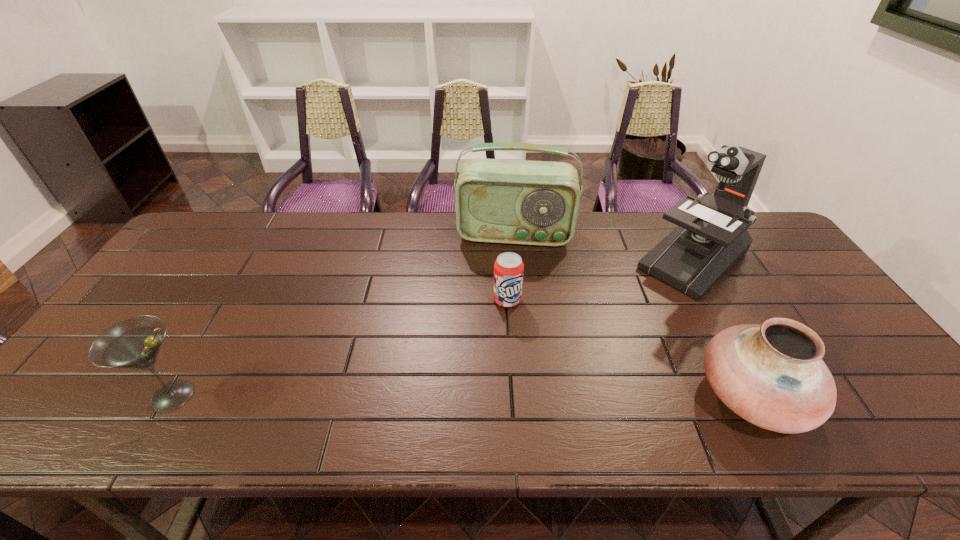
Identify the location of free point located through the eyepieces of the microscope. This screenshot has width=960, height=540. (642, 305).

Where is `vacant space situated 0.340m through the eyepieces of the microscope`? This screenshot has height=540, width=960. vacant space situated 0.340m through the eyepieces of the microscope is located at coordinates (589, 352).

You are a GUI agent. You are given a task and a screenshot of the screen. Output one action in this format:
    pyautogui.click(x=<x>, y=<y>)
    Task: Click on the vacant point located 0.220m through the eyepieces of the microscope
    The width and height of the screenshot is (960, 540).
    Given the screenshot: What is the action you would take?
    pyautogui.click(x=617, y=327)

In order to click on vacant region located 0.330m on the front panel of the radio receiver in this screenshot , I will do `click(504, 328)`.

This screenshot has height=540, width=960. I want to click on free space located on the front panel of the radio receiver, so click(x=507, y=294).

This screenshot has height=540, width=960. What are the coordinates of `free region located on the front panel of the radio receiver` in the screenshot? It's located at (508, 284).

The width and height of the screenshot is (960, 540). Identify the location of microscope present at the far edge. (711, 237).

The width and height of the screenshot is (960, 540). In order to click on radio receiver that is at the far edge in this screenshot , I will do `click(523, 202)`.

In order to click on martini present at the near edge in this screenshot , I will do `click(134, 343)`.

What are the coordinates of `pottery located in the near edge section of the desktop` in the screenshot? It's located at (772, 375).